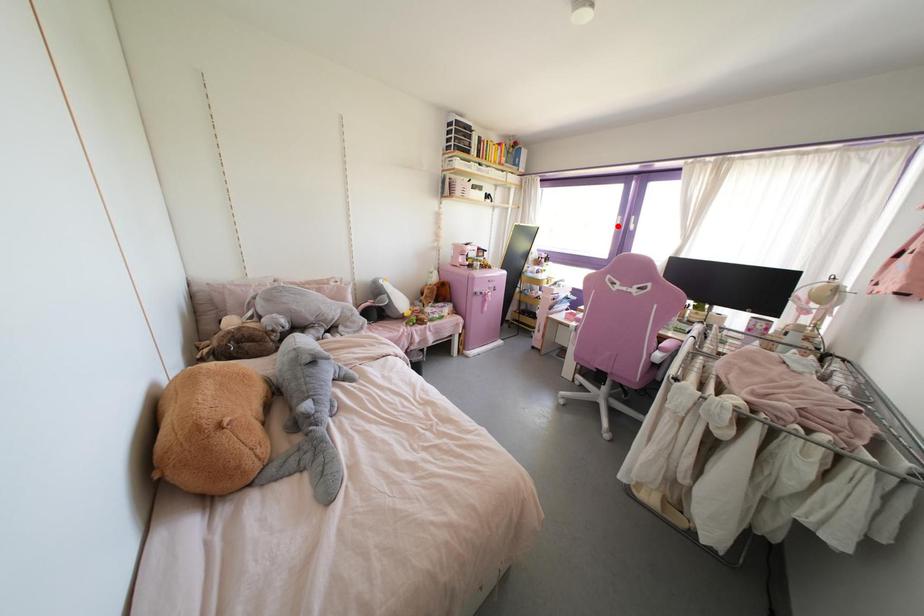
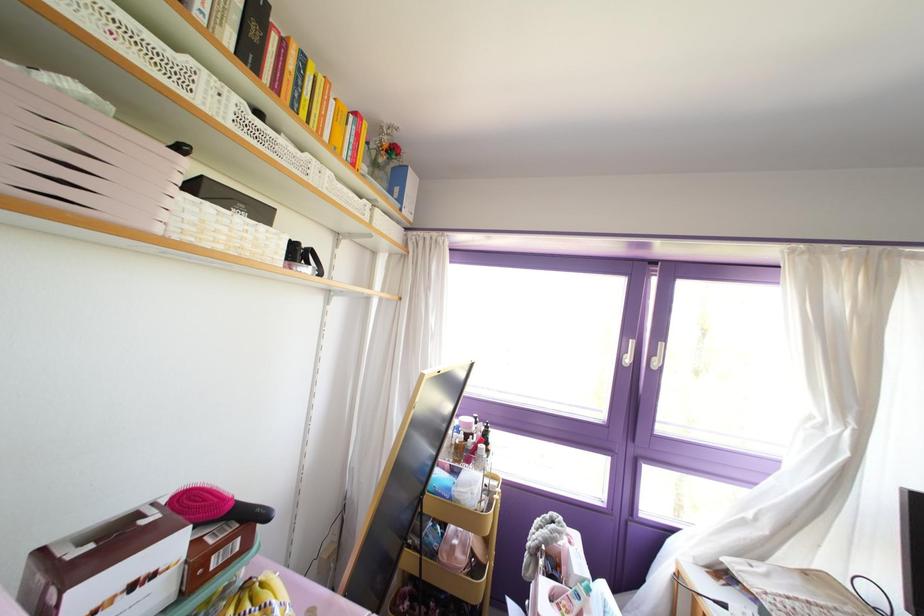
Where in the second image is the point corresponding to the highlighted location from the first image?

(626, 360)